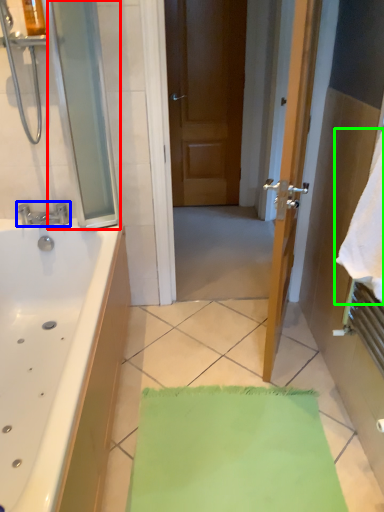
Question: Considering the real-world distances, which object is farthest from screen door (highlighted by a red box)? tap (highlighted by a blue box) or beach towel (highlighted by a green box)?

Choices:
 (A) tap
 (B) beach towel

Answer: (B)